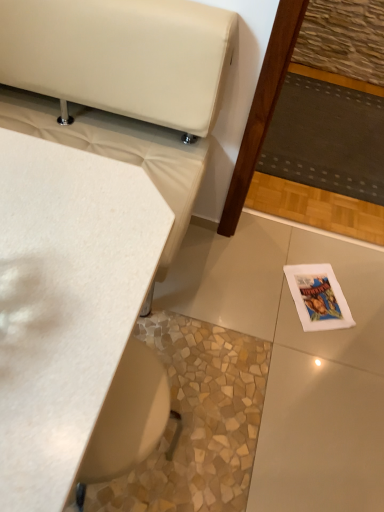
Question: Is white matte table at upper left positioned beyond the bounds of dark gray fabric mat at center right?

Choices:
 (A) no
 (B) yes

Answer: (B)

Question: Could you tell me if white matte table at upper left is facing dark gray fabric mat at center right?

Choices:
 (A) no
 (B) yes

Answer: (A)

Question: Is white matte table at upper left not close to dark gray fabric mat at center right?

Choices:
 (A) no
 (B) yes

Answer: (B)

Question: Is white matte table at upper left smaller than dark gray fabric mat at center right?

Choices:
 (A) yes
 (B) no

Answer: (B)

Question: From a real-world perspective, is white matte table at upper left located beneath dark gray fabric mat at center right?

Choices:
 (A) yes
 (B) no

Answer: (B)

Question: Looking at their shapes, would you say dark gray fabric mat at center right is wider or thinner than white matte table at upper left?

Choices:
 (A) wide
 (B) thin

Answer: (A)

Question: In the image, is dark gray fabric mat at center right on the left side or the right side of white matte table at upper left?

Choices:
 (A) right
 (B) left

Answer: (A)

Question: From a real-world perspective, relative to white matte table at upper left, is dark gray fabric mat at center right vertically above or below?

Choices:
 (A) below
 (B) above

Answer: (A)

Question: In the image, is dark gray fabric mat at center right positioned in front of or behind white matte table at upper left?

Choices:
 (A) front
 (B) behind

Answer: (B)

Question: Is dark gray fabric mat at center right inside or outside of white paper magazine at lower right?

Choices:
 (A) outside
 (B) inside

Answer: (A)

Question: Is point click(x=306, y=92) positioned closer to the camera than point click(x=307, y=290)?

Choices:
 (A) closer
 (B) farther

Answer: (B)

Question: From the image's perspective, is dark gray fabric mat at center right positioned above or below white paper magazine at lower right?

Choices:
 (A) above
 (B) below

Answer: (A)

Question: Visually, is dark gray fabric mat at center right positioned to the left or to the right of white paper magazine at lower right?

Choices:
 (A) left
 (B) right

Answer: (B)

Question: In the image, is white paper magazine at lower right positioned in front of or behind dark gray fabric mat at center right?

Choices:
 (A) front
 (B) behind

Answer: (A)

Question: Which is correct: white paper magazine at lower right is inside dark gray fabric mat at center right, or outside of it?

Choices:
 (A) inside
 (B) outside

Answer: (B)